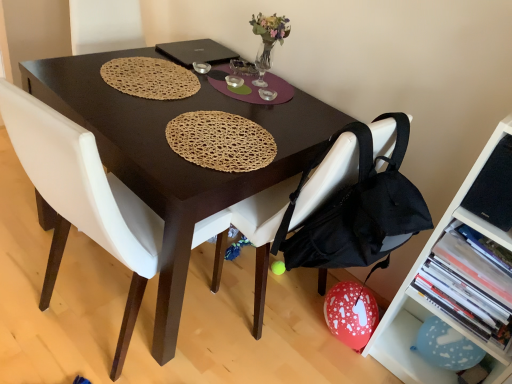
What are the coordinates of `vacant region to the left of metallic silver bowl at center` in the screenshot? It's located at (168, 61).